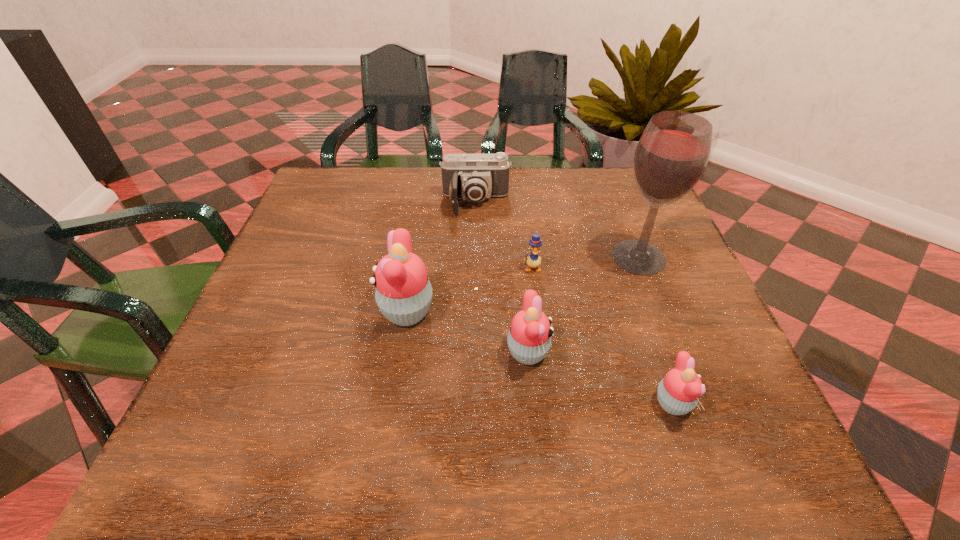
Where is `free space at the near edge of the desktop`? free space at the near edge of the desktop is located at coordinates (528, 393).

This screenshot has height=540, width=960. In the image, there is a desktop. In order to click on free space at the left edge in this screenshot , I will do `click(276, 252)`.

At what (x,y) coordinates should I click in order to perform the action: click on free space at the right edge of the desktop. Please return your answer as a coordinate pair (x, y). This screenshot has height=540, width=960. Looking at the image, I should click on (728, 355).

In the image, there is a desktop. Where is `free region at the far left corner`? The image size is (960, 540). free region at the far left corner is located at coordinates (362, 205).

At what (x,y) coordinates should I click in order to perform the action: click on vacant space at the near left corner. Please return your answer as a coordinate pair (x, y). This screenshot has width=960, height=540. Looking at the image, I should click on (300, 377).

I want to click on vacant space at the far right corner, so click(x=600, y=169).

The width and height of the screenshot is (960, 540). Identify the location of vacant space in between the tallest object and the duckling. (586, 262).

The image size is (960, 540). I want to click on free point between the alcohol and the camera, so click(x=557, y=230).

Find the location of a particular element. free space that is in between the second tallest cupcake and the alcohol is located at coordinates (583, 305).

This screenshot has height=540, width=960. I want to click on free spot between the rightmost cupcake and the second cupcake from left to right, so (x=600, y=378).